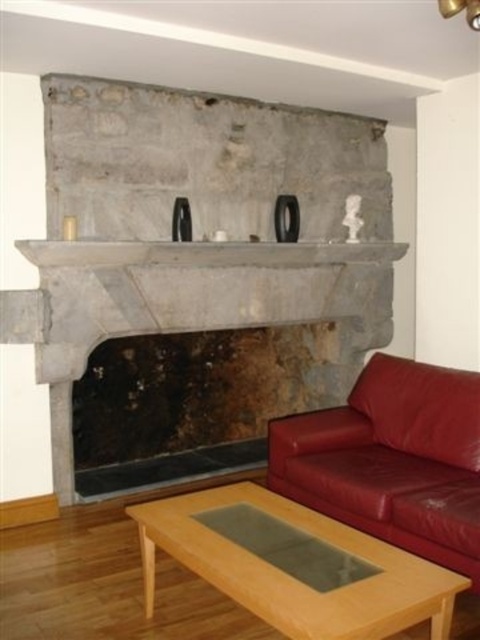
Consider the image. Can you confirm if natural stone fireplace at center is positioned to the left of light brown wood coffee table at lower center?

Indeed, natural stone fireplace at center is positioned on the left side of light brown wood coffee table at lower center.

Does natural stone fireplace at center have a smaller size compared to light brown wood coffee table at lower center?

No, natural stone fireplace at center is not smaller than light brown wood coffee table at lower center.

Is point (78, 330) positioned behind point (239, 548)?

That is True.

Where is `natural stone fireplace at center`? This screenshot has height=640, width=480. natural stone fireplace at center is located at coordinates (192, 305).

Who is positioned more to the right, natural stone fireplace at center or matte leather couch at center?

From the viewer's perspective, matte leather couch at center appears more on the right side.

Locate an element on the screen. Image resolution: width=480 pixels, height=640 pixels. natural stone fireplace at center is located at coordinates (192, 305).

Locate an element on the screen. This screenshot has width=480, height=640. natural stone fireplace at center is located at coordinates (192, 305).

Who is positioned more to the left, matte leather couch at center or gray stone mantle at center?

Positioned to the left is gray stone mantle at center.

Between matte leather couch at center and gray stone mantle at center, which one has more height?

Standing taller between the two is matte leather couch at center.

Where is `matte leather couch at center`? matte leather couch at center is located at coordinates [392, 460].

At what (x,y) coordinates should I click in order to perform the action: click on matte leather couch at center. Please return your answer as a coordinate pair (x, y). Image resolution: width=480 pixels, height=640 pixels. Looking at the image, I should click on (392, 460).